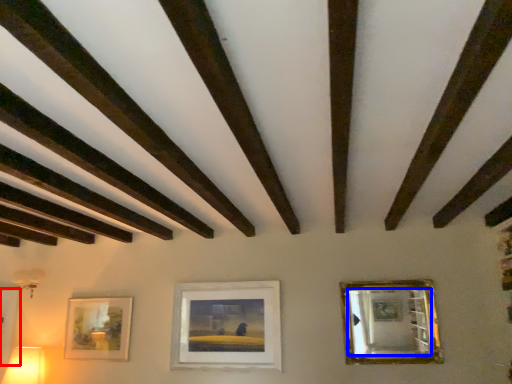
Question: Which of the following is the closest to the observer, picture frame (highlighted by a red box) or mirror (highlighted by a blue box)?

Choices:
 (A) picture frame
 (B) mirror

Answer: (B)